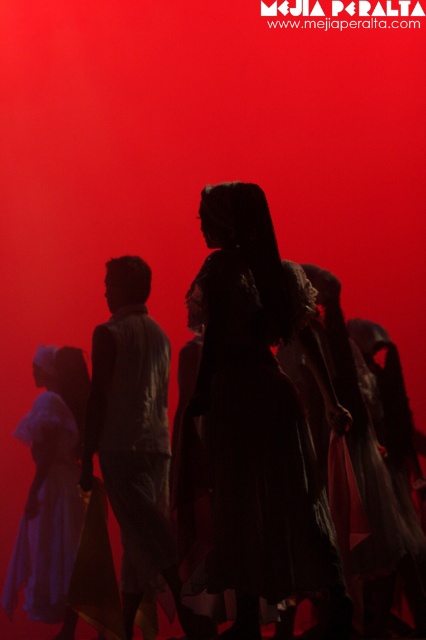
You are standing at the origin point in the image. There are two points marked in the scene, point [285,433] and point [152,554]. Which point is closer to you?

Point [285,433] is in front of point [152,554], so it is closer to you.

You are an observer positioned at the origin point of the image. There is a silhouette dress at center located at point (259, 416). Can you tell me the exact coordinates of the silhouette dress at center?

The silhouette dress at center is located exactly at point (259, 416).

In the scene with a vivid red background, there are two central figures dressed in a silhouette dress at center and a matte gray shirt at center. From the perspective of someone standing in front of the scene, which clothing item is positioned to the right?

The silhouette dress at center is positioned to the right of the matte gray shirt at center.